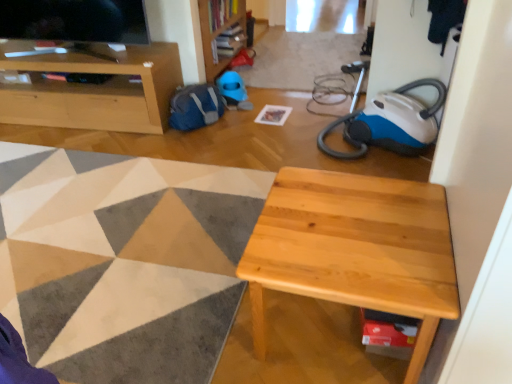
Locate an element on the screen. The image size is (512, 384). free point above white paper at center (from a real-world perspective) is located at coordinates click(275, 110).